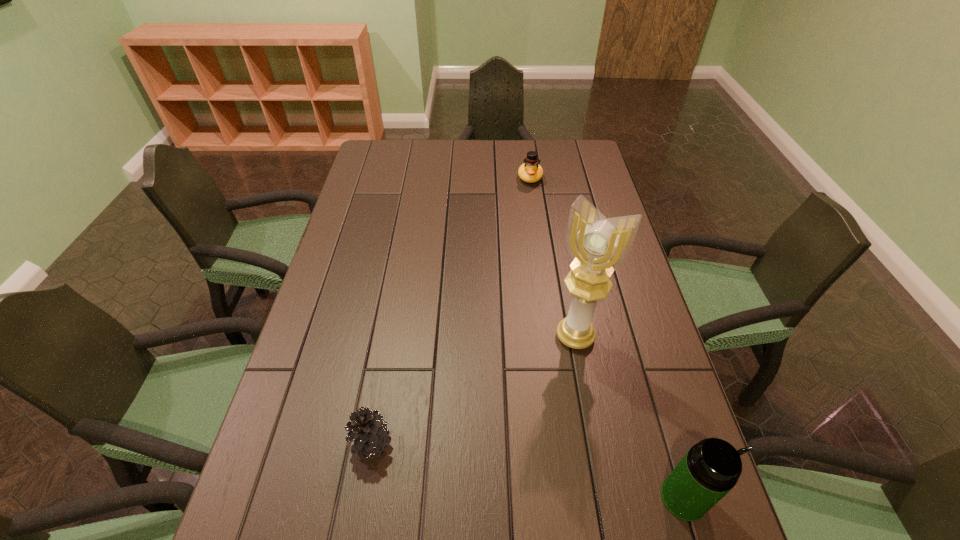
I want to click on the leftmost object, so point(368,429).

This screenshot has height=540, width=960. Find the location of `pinecone`. pinecone is located at coordinates (368, 429).

At what (x,y) coordinates should I click in order to perform the action: click on thermos bottle. Please return your answer as a coordinate pair (x, y). The height and width of the screenshot is (540, 960). Looking at the image, I should click on (711, 468).

This screenshot has height=540, width=960. I want to click on the second tallest object, so click(711, 468).

I want to click on award, so click(598, 245).

The image size is (960, 540). What are the coordinates of `the tallest object` in the screenshot? It's located at (598, 245).

Locate an element on the screen. the farthest object is located at coordinates (530, 172).

Where is `vacant space located on the left of the pinecone`? vacant space located on the left of the pinecone is located at coordinates (323, 443).

This screenshot has height=540, width=960. In order to click on vacant region located on the front-facing side of the second farthest object in this screenshot , I will do `click(491, 475)`.

At what (x,y) coordinates should I click in order to perform the action: click on vacant space located on the front-facing side of the second farthest object. Please return your answer as a coordinate pair (x, y). The image size is (960, 540). Looking at the image, I should click on (512, 438).